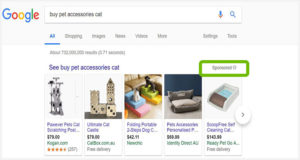
Locate an element on the screen. The image size is (300, 160). cat accessories is located at coordinates (66, 94), (102, 103), (133, 103), (154, 96), (181, 103), (221, 100).